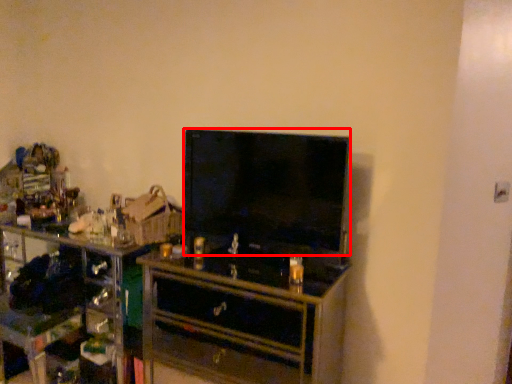
Question: From the image, what is the correct spatial relationship of television (annotated by the red box) in relation to chest of drawers?

Choices:
 (A) right
 (B) left

Answer: (A)